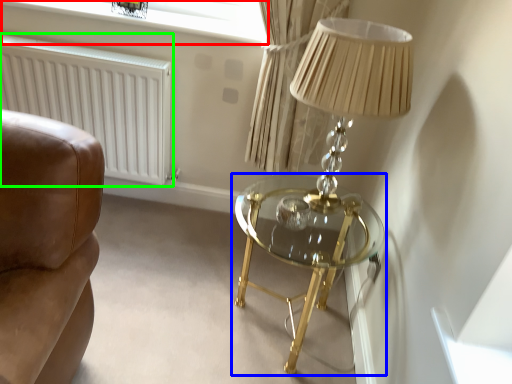
Question: Which object is the closest to the window screen (highlighted by a red box)? Choose among these: table (highlighted by a blue box) or radiator (highlighted by a green box).

Choices:
 (A) table
 (B) radiator

Answer: (B)